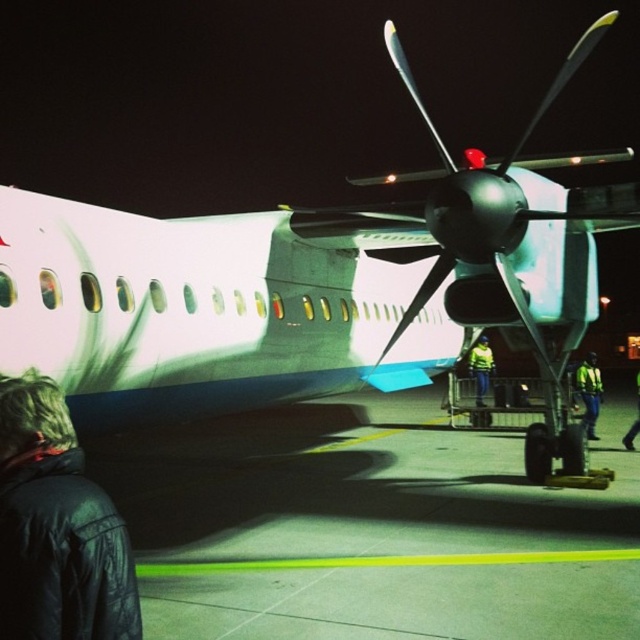
How distant is reflective yellow safety vest at lower right from yellow reflective vest at center?

A distance of 2.76 meters exists between reflective yellow safety vest at lower right and yellow reflective vest at center.

Is reflective yellow safety vest at lower right below yellow reflective vest at center?

Incorrect, reflective yellow safety vest at lower right is not positioned below yellow reflective vest at center.

Measure the distance between point (600, 378) and camera.

Point (600, 378) is 61.94 feet from camera.

Where is `reflective yellow safety vest at lower right`? This screenshot has height=640, width=640. reflective yellow safety vest at lower right is located at coordinates (589, 392).

Can you confirm if black leather jacket at lower left is positioned to the left of yellow reflective vest at center?

Indeed, black leather jacket at lower left is positioned on the left side of yellow reflective vest at center.

Which is below, black leather jacket at lower left or yellow reflective vest at center?

Positioned lower is yellow reflective vest at center.

Which is in front, point (115, 560) or point (477, 397)?

Point (115, 560)

The width and height of the screenshot is (640, 640). Identify the location of black leather jacket at lower left. (56, 528).

Between point (36, 637) and point (637, 408), which one is positioned behind?

The point (637, 408) is more distant.

From the picture: Measure the distance between black leather jacket at lower left and yellow reflective vest at lower right.

black leather jacket at lower left and yellow reflective vest at lower right are 9.45 meters apart from each other.

Where is `black leather jacket at lower left`? black leather jacket at lower left is located at coordinates (56, 528).